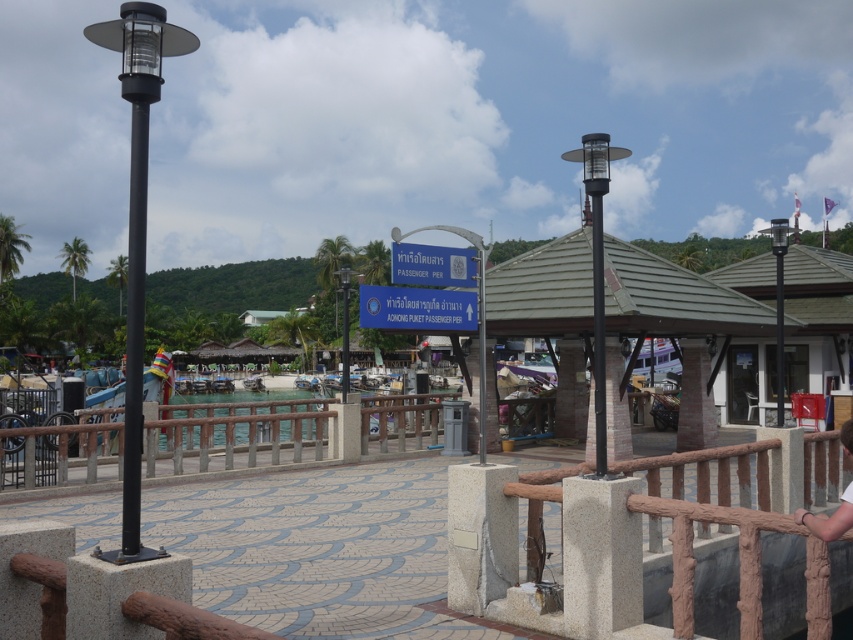
Question: Is rustic wood rail at lower center positioned at the back of black metal pole at left?

Choices:
 (A) yes
 (B) no

Answer: (B)

Question: Does brown textured rail at center have a lesser width compared to light brown wooden railing at lower right?

Choices:
 (A) yes
 (B) no

Answer: (B)

Question: Which object is farther from the camera taking this photo?

Choices:
 (A) brown textured rail at center
 (B) black metal pole at left
 (C) rustic wood rail at lower center

Answer: (A)

Question: Which object is farther from the camera taking this photo?

Choices:
 (A) brown textured rail at center
 (B) light brown wooden railing at lower right

Answer: (A)

Question: Can you confirm if black metal pole at left is positioned to the right of light brown wooden railing at lower right?

Choices:
 (A) yes
 (B) no

Answer: (B)

Question: Based on their relative distances, which object is farther from the light brown wooden railing at lower right?

Choices:
 (A) brown textured rail at center
 (B) rustic wood rail at lower center
 (C) black metal pole at left

Answer: (B)